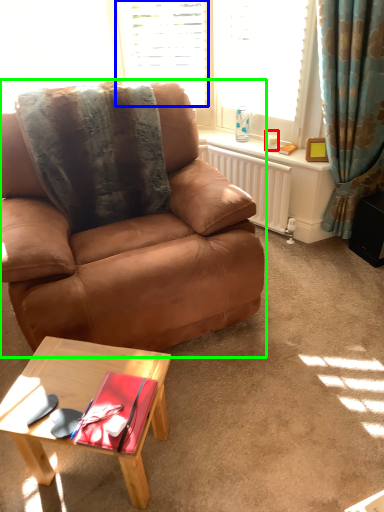
Question: Estimate the real-world distances between objects in this image. Which object is farther from coffee cup (highlighted by a red box), window (highlighted by a blue box) or chair (highlighted by a green box)?

Choices:
 (A) window
 (B) chair

Answer: (B)